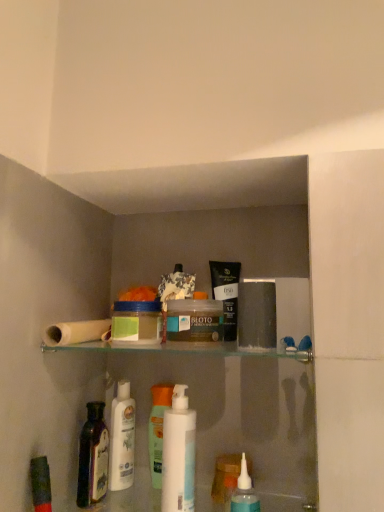
Question: From the image's perspective, is white plastic bottle at center, the first toiletry positioned from the left, on matte black tube at upper center, the 4th toiletry positioned from the left?

Choices:
 (A) yes
 (B) no

Answer: (B)

Question: Is white plastic bottle at center, the first toiletry positioned from the left, in front of matte black tube at upper center, the 4th toiletry positioned from the left?

Choices:
 (A) yes
 (B) no

Answer: (B)

Question: Does white plastic bottle at center, the first toiletry positioned from the left, turn towards matte black tube at upper center, the 4th toiletry positioned from the left?

Choices:
 (A) no
 (B) yes

Answer: (A)

Question: Can you confirm if white plastic bottle at center, which is the fourth toiletry in right-to-left order, is taller than matte black tube at upper center, placed as the 1th toiletry when sorted from right to left?

Choices:
 (A) yes
 (B) no

Answer: (A)

Question: Is white plastic bottle at center, the first toiletry positioned from the left, placed right next to matte black tube at upper center, placed as the 1th toiletry when sorted from right to left?

Choices:
 (A) no
 (B) yes

Answer: (A)

Question: Does point [160, 391] appear closer or farther from the camera than point [165, 458]?

Choices:
 (A) farther
 (B) closer

Answer: (A)

Question: Do you think translucent plastic bottle at center, which appears as the second toiletry when viewed from the left, is within white plastic bottle at center, marked as the first mouthwash in a bottom-to-top arrangement, or outside of it?

Choices:
 (A) inside
 (B) outside

Answer: (B)

Question: From the image's perspective, relative to white plastic bottle at center, placed as the third mouthwash when sorted from top to bottom, is translucent plastic bottle at center, which appears as the second toiletry when viewed from the left, above or below?

Choices:
 (A) above
 (B) below

Answer: (B)

Question: From a real-world perspective, is translucent plastic bottle at center, positioned as the 3th toiletry in right-to-left order, positioned above or below white plastic bottle at center, placed as the third mouthwash when sorted from top to bottom?

Choices:
 (A) below
 (B) above

Answer: (A)

Question: In the image, is matte black tube at upper center, placed as the 1th toiletry when sorted from right to left, on the left side or the right side of clear plastic bottle at lower center, the 2th toiletry from the right?

Choices:
 (A) right
 (B) left

Answer: (A)

Question: From a real-world perspective, is matte black tube at upper center, placed as the 1th toiletry when sorted from right to left, positioned above or below clear plastic bottle at lower center, which is counted as the third toiletry, starting from the left?

Choices:
 (A) above
 (B) below

Answer: (A)

Question: Is matte black tube at upper center, placed as the 1th toiletry when sorted from right to left, wider or thinner than clear plastic bottle at lower center, the 2th toiletry from the right?

Choices:
 (A) thin
 (B) wide

Answer: (B)

Question: Is matte black tube at upper center, the 4th toiletry positioned from the left, situated inside clear plastic bottle at lower center, which is counted as the third toiletry, starting from the left, or outside?

Choices:
 (A) outside
 (B) inside

Answer: (A)

Question: Is white matte toilet paper at upper left wider or thinner than translucent plastic bottle at center, which appears as the second toiletry when viewed from the left?

Choices:
 (A) wide
 (B) thin

Answer: (A)

Question: Based on their positions, is white matte toilet paper at upper left located to the left or right of translucent plastic bottle at center, which appears as the second toiletry when viewed from the left?

Choices:
 (A) right
 (B) left

Answer: (B)